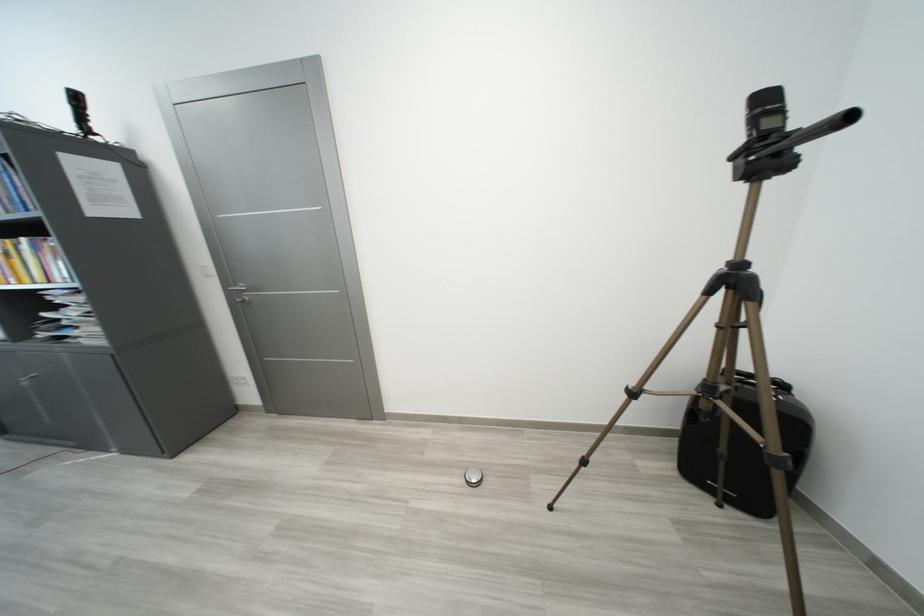
Find the location of a particular element. This screenshot has width=924, height=616. black case handle is located at coordinates [762, 379].